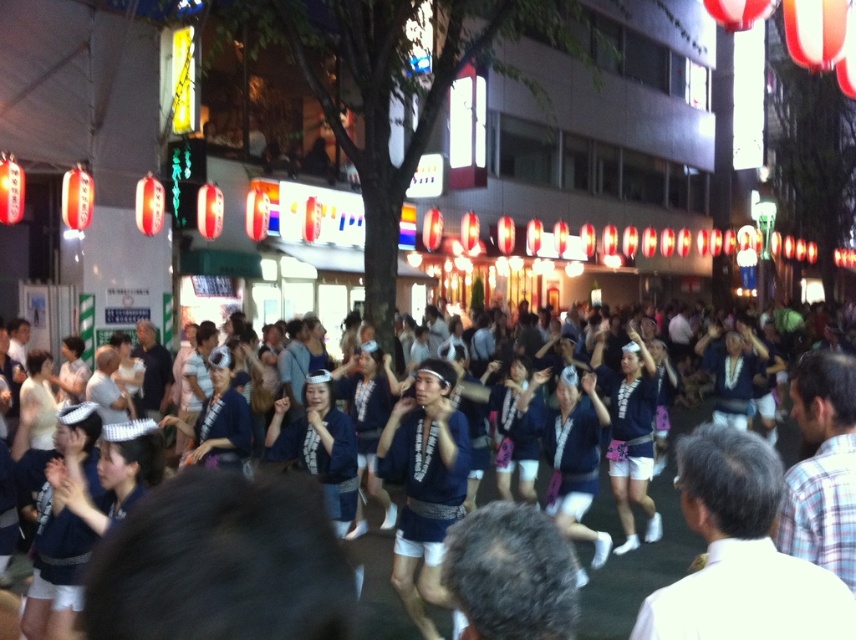
Question: Which of the following is the farthest from the observer?

Choices:
 (A) white cotton shirt at center
 (B) blue fabric kimono at center
 (C) matte blue kimono at center
 (D) blue fabric at center

Answer: (C)

Question: Which point is closer to the camera taking this photo?

Choices:
 (A) (703, 413)
 (B) (428, 451)

Answer: (B)

Question: Considering the relative positions of white cotton shirt at center and matte blue kimono at center in the image provided, where is white cotton shirt at center located with respect to matte blue kimono at center?

Choices:
 (A) above
 (B) below

Answer: (A)

Question: Does white cotton shirt at center appear on the right side of matte blue kimono at center?

Choices:
 (A) no
 (B) yes

Answer: (A)

Question: Observing the image, what is the correct spatial positioning of blue fabric at center in reference to matte blue kimono at center?

Choices:
 (A) left
 (B) right

Answer: (B)

Question: Which object is farther from the camera taking this photo?

Choices:
 (A) blue fabric at center
 (B) white cotton shirt at center
 (C) blue fabric kimono at center

Answer: (C)